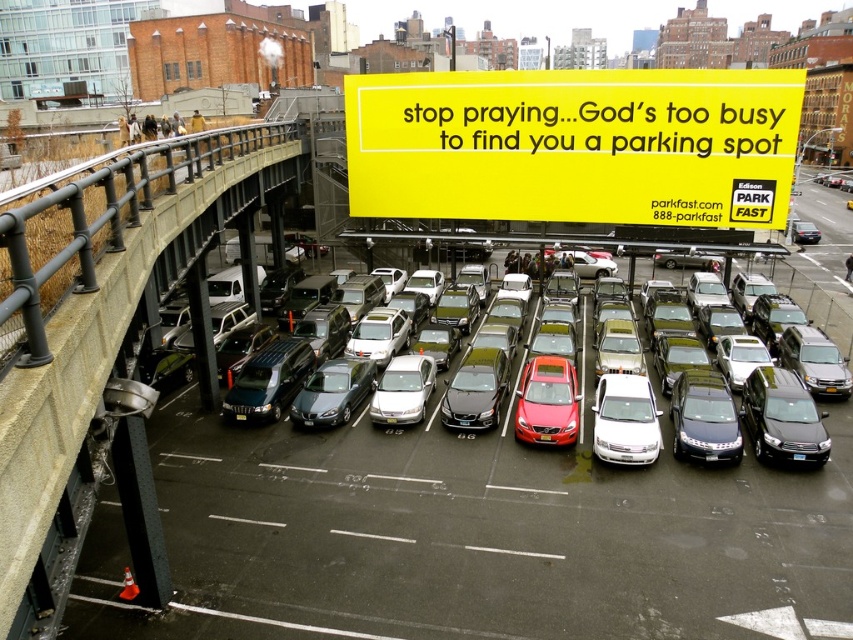
Question: Is satin black sedan at center bigger than metallic gray sedan at center?

Choices:
 (A) no
 (B) yes

Answer: (B)

Question: Which of the following is the closest to the observer?

Choices:
 (A) (343, 456)
 (B) (809, 419)
 (C) (819, 230)
 (D) (717, 433)

Answer: (D)

Question: Which point appears farthest from the camera in this image?

Choices:
 (A) (792, 221)
 (B) (314, 480)
 (C) (636, 410)

Answer: (A)

Question: Can you confirm if shiny black sedan at center is positioned to the left of metallic silver sedan at center?

Choices:
 (A) yes
 (B) no

Answer: (A)

Question: Which object is positioned closest to the metallic silver sedan at center?

Choices:
 (A) metallic gray sedan at center
 (B) white glossy sedan at center
 (C) satin black sedan at center

Answer: (C)

Question: Can you confirm if yellow paper sign at upper center is bigger than metallic silver sedan at center?

Choices:
 (A) no
 (B) yes

Answer: (B)